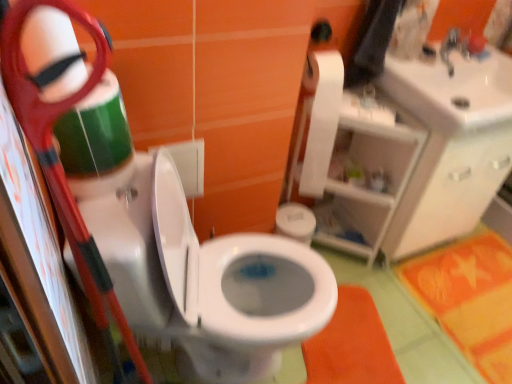
Image resolution: width=512 pixels, height=384 pixels. I want to click on empty space that is ontop of white plastic shelf at upper right, so click(x=369, y=104).